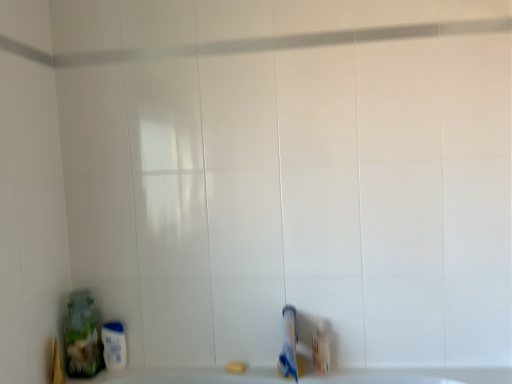
Question: Is blue matte toothpaste at lower center inside translucent plastic bottle at lower right?

Choices:
 (A) no
 (B) yes

Answer: (A)

Question: Can you confirm if translucent plastic bottle at lower right is taller than blue matte toothpaste at lower center?

Choices:
 (A) no
 (B) yes

Answer: (B)

Question: Considering the relative positions of translucent plastic bottle at lower right and blue matte toothpaste at lower center in the image provided, is translucent plastic bottle at lower right in front of blue matte toothpaste at lower center?

Choices:
 (A) yes
 (B) no

Answer: (B)

Question: Is translucent plastic bottle at lower right next to blue matte toothpaste at lower center and touching it?

Choices:
 (A) yes
 (B) no

Answer: (B)

Question: Is translucent plastic bottle at lower right at the left side of blue matte toothpaste at lower center?

Choices:
 (A) no
 (B) yes

Answer: (A)

Question: Is translucent plastic bottle at lower right at the right side of blue matte toothpaste at lower center?

Choices:
 (A) yes
 (B) no

Answer: (A)

Question: Is yellow matte bar of soap at lower center far away from blue matte toothpaste at lower center?

Choices:
 (A) yes
 (B) no

Answer: (B)

Question: From a real-world perspective, is yellow matte bar of soap at lower center physically above blue matte toothpaste at lower center?

Choices:
 (A) no
 (B) yes

Answer: (A)

Question: Is yellow matte bar of soap at lower center taller than blue matte toothpaste at lower center?

Choices:
 (A) yes
 (B) no

Answer: (B)

Question: From the image's perspective, is yellow matte bar of soap at lower center on blue matte toothpaste at lower center?

Choices:
 (A) no
 (B) yes

Answer: (A)

Question: Could you tell me if yellow matte bar of soap at lower center is turned towards blue matte toothpaste at lower center?

Choices:
 (A) yes
 (B) no

Answer: (B)

Question: Is yellow matte bar of soap at lower center further to the viewer compared to blue matte toothpaste at lower center?

Choices:
 (A) no
 (B) yes

Answer: (B)

Question: Considering the relative positions of translucent plastic bottle at lower right and yellow matte bar of soap at lower center in the image provided, is translucent plastic bottle at lower right behind yellow matte bar of soap at lower center?

Choices:
 (A) yes
 (B) no

Answer: (B)